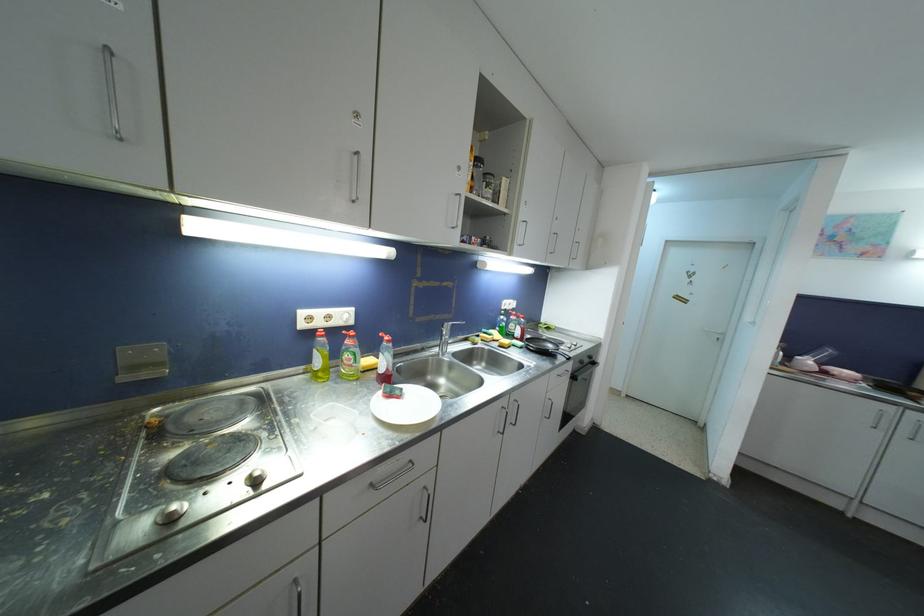
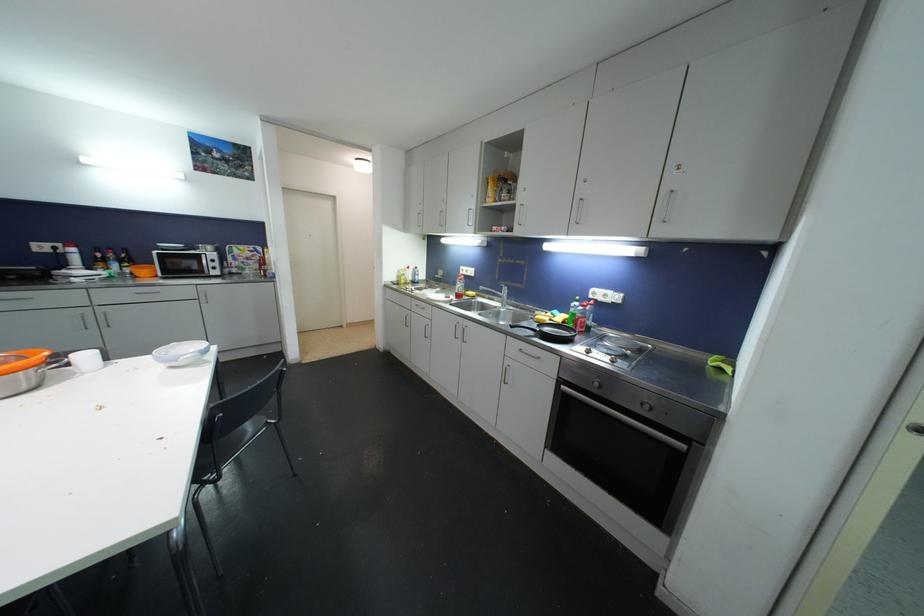
In the second image, find the point that corresponds to (x=421, y=322) in the first image.

(504, 285)